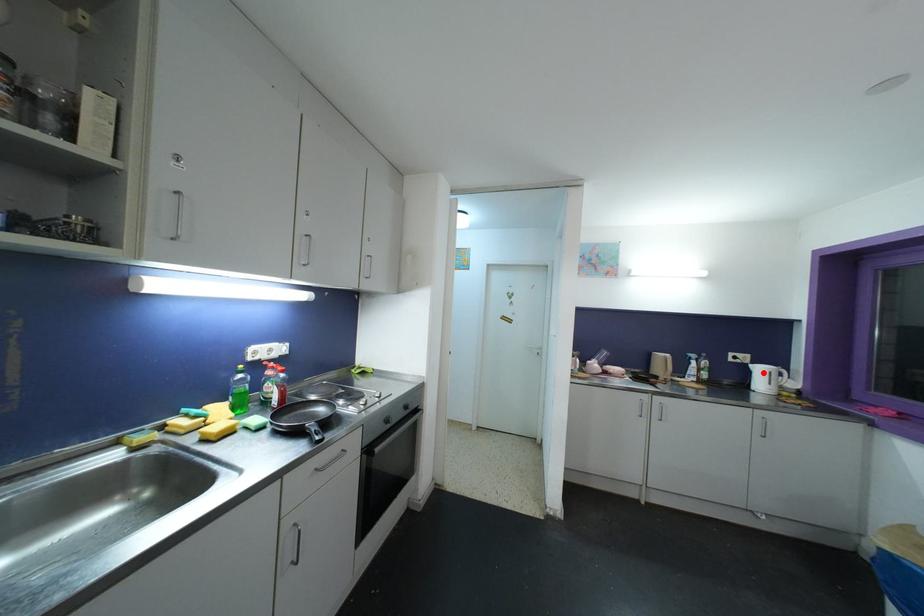
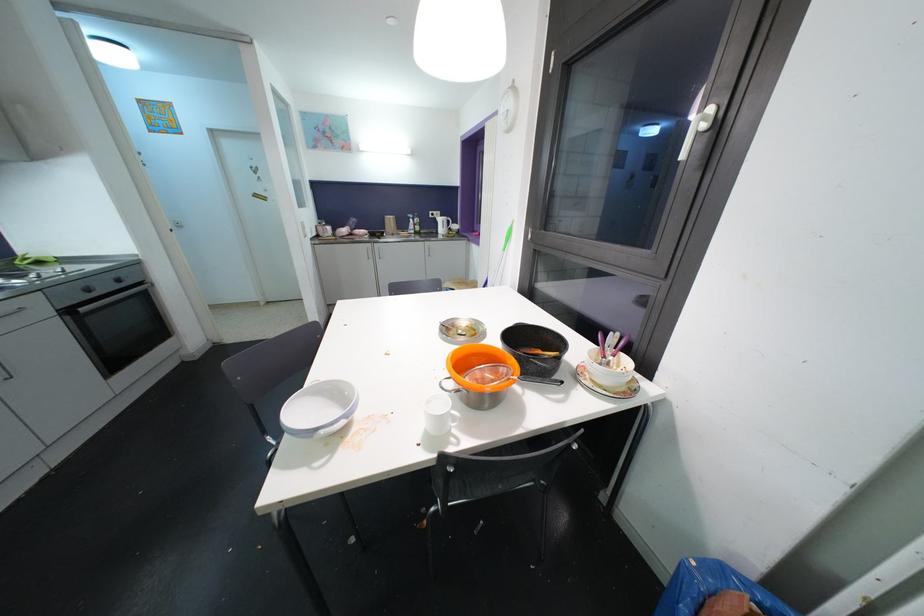
Where in the second image is the point corresponding to the highlighted location from the first image?

(444, 223)